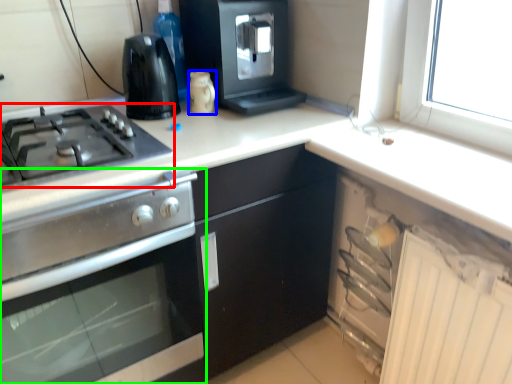
Question: Based on their relative distances, which object is farther from gas stove (highlighted by a red box)? Choose from kitchen appliance (highlighted by a blue box) and kitchen appliance (highlighted by a green box).

Choices:
 (A) kitchen appliance
 (B) kitchen appliance

Answer: (A)